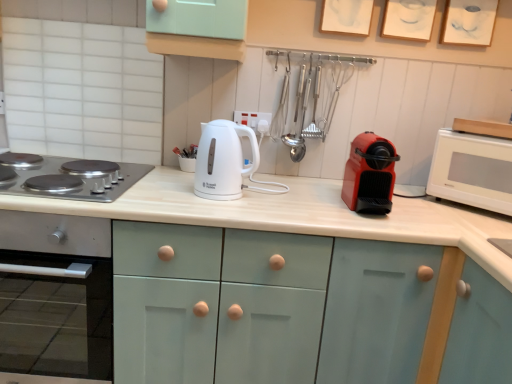
Locate an element on the screen. The height and width of the screenshot is (384, 512). vacant region to the right of red matte coffee machine at right, the 1th kitchen appliance from the right is located at coordinates (419, 214).